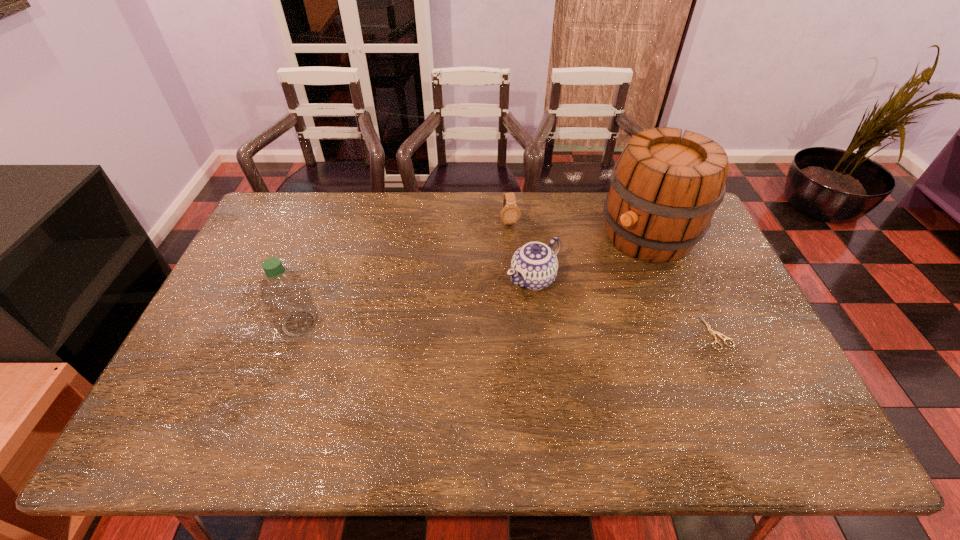
Where is `vacant space on the desktop that is between the water bottle and the shears and is positioned at the spout of the third tallest object`? vacant space on the desktop that is between the water bottle and the shears and is positioned at the spout of the third tallest object is located at coordinates (468, 327).

Identify the location of free spot on the desktop that is between the leftmost object and the shortest object and is positioned on the face of the fourth tallest object. (537, 328).

I want to click on free space on the desktop that is between the fourth shortest object and the shortest object and is positioned on the side of the tallest object where the spigot is located, so click(x=526, y=328).